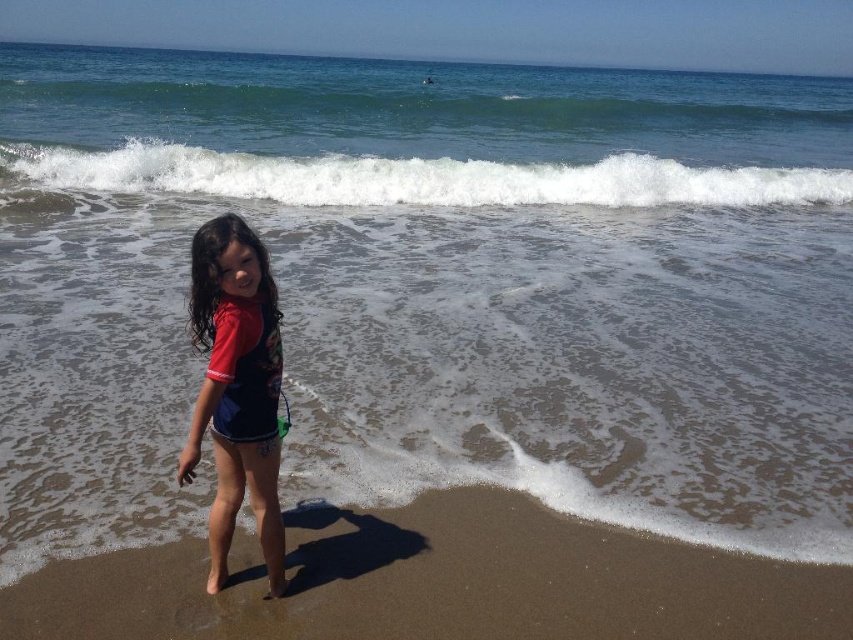
Who is shorter, green smooth wave at upper center or white frothy wave at upper center?

white frothy wave at upper center

Is green smooth wave at upper center bigger than white frothy wave at upper center?

Yes.

Is point (254, 104) positioned after point (796, 176)?

Yes, it is.

You are a GUI agent. You are given a task and a screenshot of the screen. Output one action in this format:
    pyautogui.click(x=<x>, y=<y>)
    Task: Click on the green smooth wave at upper center
    
    Given the screenshot: What is the action you would take?
    pyautogui.click(x=415, y=102)

Who is lower down, brown sandy beach at lower center or green smooth wave at upper center?

brown sandy beach at lower center

Who is higher up, brown sandy beach at lower center or green smooth wave at upper center?

green smooth wave at upper center is above.

Who is more forward, [796,596] or [813,134]?

Positioned in front is point [796,596].

Image resolution: width=853 pixels, height=640 pixels. What are the coordinates of `brown sandy beach at lower center` in the screenshot? It's located at (437, 582).

Which is above, green smooth wave at upper center or matte red swimsuit at center?

green smooth wave at upper center is higher up.

Who is positioned more to the right, green smooth wave at upper center or matte red swimsuit at center?

green smooth wave at upper center

Is point (607, 83) closer to viewer compared to point (270, 563)?

No, it is behind (270, 563).

Locate an element on the screen. The image size is (853, 640). green smooth wave at upper center is located at coordinates (415, 102).